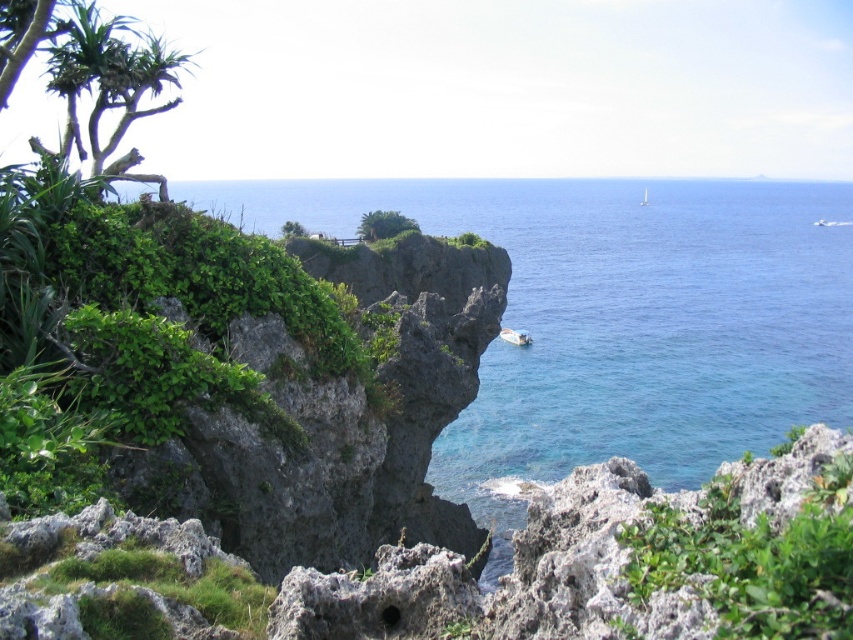
You are standing at the camera position and want to take a photo of the green leafy shrub at left. Can you estimate how far you need to walk forward to get the shrub to fill the frame better?

The green leafy shrub at left is 5.30 meters away from the camera. To get it to fill the frame better, you would need to walk closer, reducing the distance between you and the shrub.

You are standing on the rocky shore and see the green leafy plant at center and the white glossy boat at center. Which object is closer to you?

The green leafy plant at center is closer to you since it is positioned over the white glossy boat at center, indicating it is in a more foreground layer.

Based on the scene description, where is the green leafy shrub at left located in terms of its 2D coordinates?

The green leafy shrub at left is located at the 2D coordinates of point (134, 323).